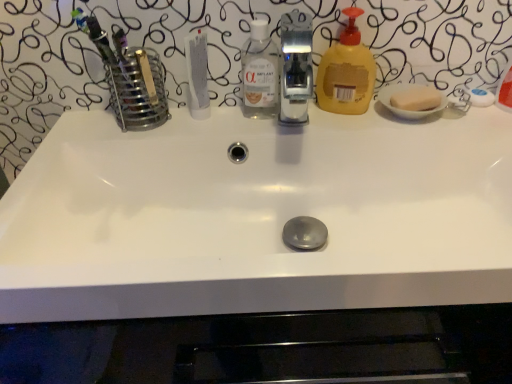
Identify the location of free spot to the left of white matte tube at center. The height and width of the screenshot is (384, 512). (113, 126).